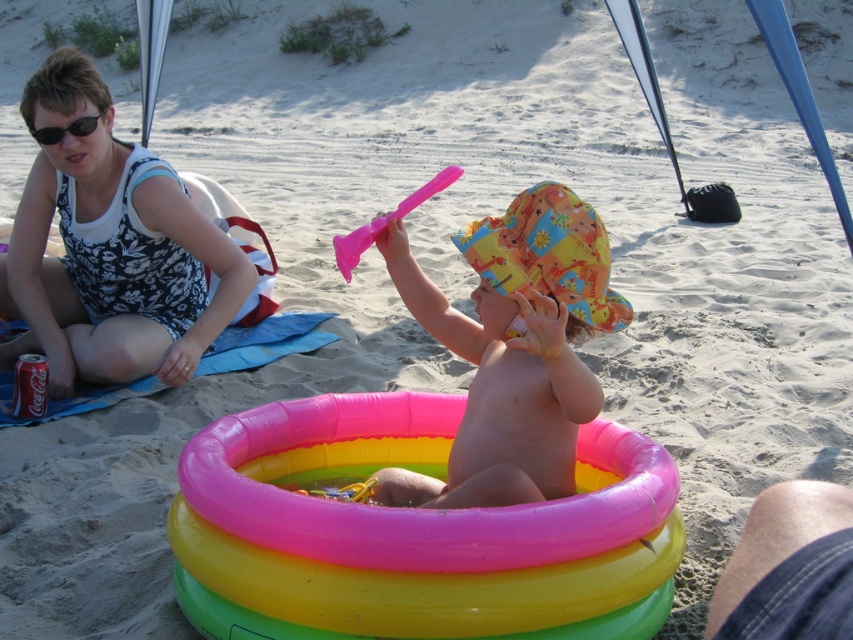
You are a photographer standing at the edge of the beach. You want to take a photo that includes both the inflatable pool with the child and the adult on the towel. Which of the two points, point (572, 371) or point (73, 124), should you focus on first to ensure both subjects are in sharp focus?

Point (572, 371) should be focused on first because it is closer to the viewer than point (73, 124), ensuring the inflatable pool with the child is in focus before adjusting for the adult.

You are standing on the beach and want to walk from the inflatable pool to the Coca Cola can. Which point, point (70,97) or point (392,216), is closer to you as you start walking?

Point (70,97) is closer to you because it is further to the viewer than point (392,216), meaning it is nearer in your line of sight.